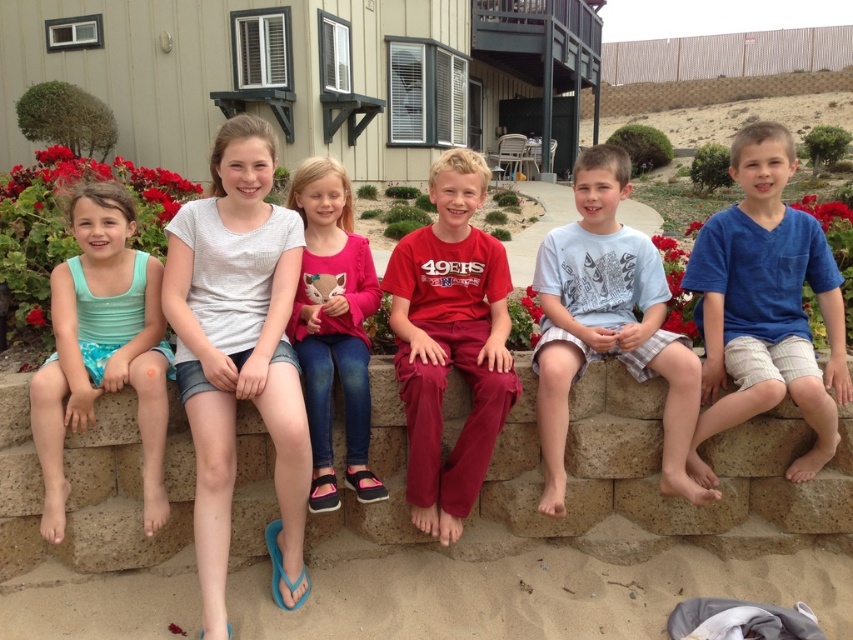
Is point (430, 241) closer to camera compared to point (144, 342)?

No.

Is red matte pants at center shorter than matte teal swimsuit at left?

No, red matte pants at center is not shorter than matte teal swimsuit at left.

The width and height of the screenshot is (853, 640). What are the coordinates of `red matte pants at center` in the screenshot? It's located at (450, 342).

I want to click on red matte pants at center, so click(450, 342).

Does point (743, 234) lie in front of point (498, 269)?

Yes, point (743, 234) is in front of point (498, 269).

Does blue cotton shirt at center come behind red matte pants at center?

Yes, blue cotton shirt at center is further from the viewer.

You are a GUI agent. You are given a task and a screenshot of the screen. Output one action in this format:
    pyautogui.click(x=<x>, y=<y>)
    Task: Click on the blue cotton shirt at center
    
    Given the screenshot: What is the action you would take?
    pyautogui.click(x=764, y=305)

Where is `blue cotton shirt at center`? blue cotton shirt at center is located at coordinates (764, 305).

Is point (439, 314) positioned in front of point (312, 262)?

That is True.

Describe the element at coordinates (450, 342) in the screenshot. The width and height of the screenshot is (853, 640). I see `red matte pants at center` at that location.

The image size is (853, 640). What are the coordinates of `red matte pants at center` in the screenshot? It's located at (450, 342).